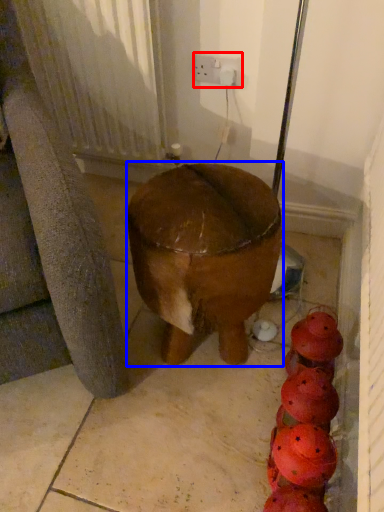
Question: Which object is further to the camera taking this photo, electric outlet (highlighted by a red box) or furniture (highlighted by a blue box)?

Choices:
 (A) electric outlet
 (B) furniture

Answer: (A)